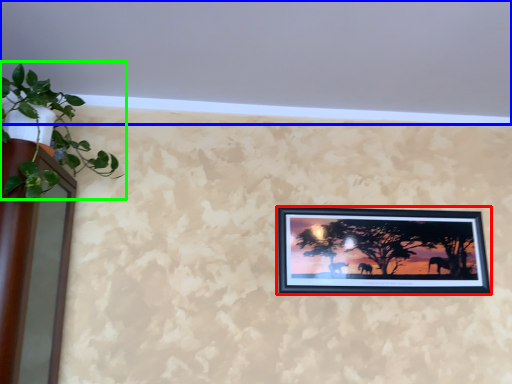
Question: Which is farther away from picture frame (highlighted by a red box)? backdrop (highlighted by a blue box) or houseplant (highlighted by a green box)?

Choices:
 (A) backdrop
 (B) houseplant

Answer: (B)